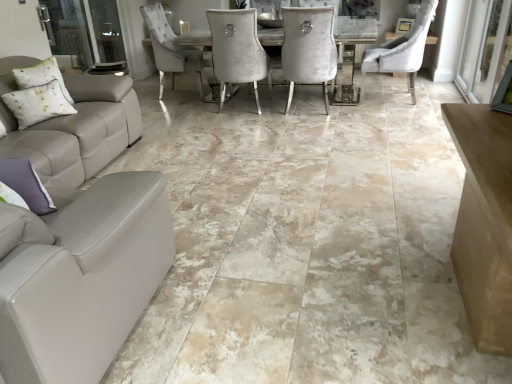
I want to click on blank area beneath velvet beige chair at center, acting as the 2th chair starting from the left (from a real-world perspective), so click(x=392, y=100).